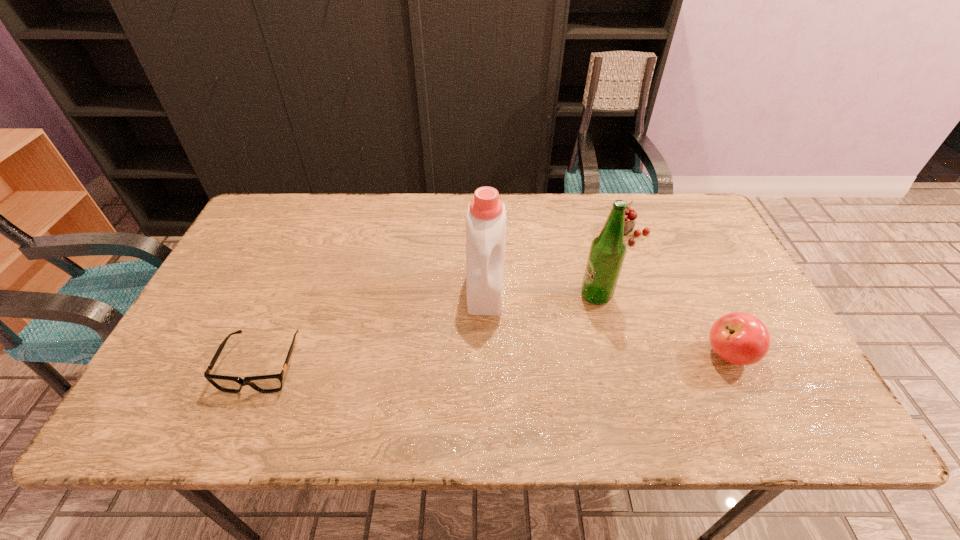
The width and height of the screenshot is (960, 540). I want to click on free point between the second object from left to right and the pot filled with cherries, so click(555, 261).

The image size is (960, 540). What are the coordinates of `empty location between the shortest object and the beer bottle` in the screenshot? It's located at (429, 330).

The width and height of the screenshot is (960, 540). I want to click on vacant area that lies between the rightmost object and the third object from right to left, so click(662, 325).

The height and width of the screenshot is (540, 960). Identify the location of vacant space that is in between the pot filled with cherries and the fourth object from right to left. (555, 261).

Locate an element on the screen. The width and height of the screenshot is (960, 540). unoccupied area between the fourth object from left to right and the rightmost object is located at coordinates (677, 294).

You are a GUI agent. You are given a task and a screenshot of the screen. Output one action in this format:
    pyautogui.click(x=<x>, y=<y>)
    Task: Click on the empty space that is in between the beer bottle and the fourth object from right to left
    The width and height of the screenshot is (960, 540).
    Given the screenshot: What is the action you would take?
    pyautogui.click(x=540, y=293)

The height and width of the screenshot is (540, 960). Find the location of `vacant point located between the beer bottle and the sunglasses`. vacant point located between the beer bottle and the sunglasses is located at coordinates (429, 330).

Find the location of a particular element. This screenshot has width=960, height=540. free spot between the rightmost object and the third object from right to left is located at coordinates (662, 325).

Locate an element on the screen. free point between the third object from right to left and the second object from left to right is located at coordinates (540, 293).

Identify which object is located as the second nearest to the third object from right to left. Please provide its 2D coordinates. Your answer should be formatted as a tuple, i.e. [(x, y)], where the tuple contains the x and y coordinates of a point satisfying the conditions above.

[(740, 338)]